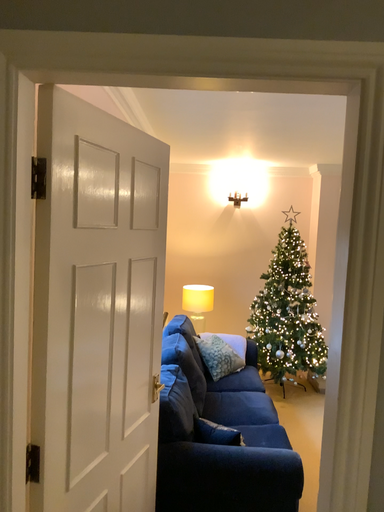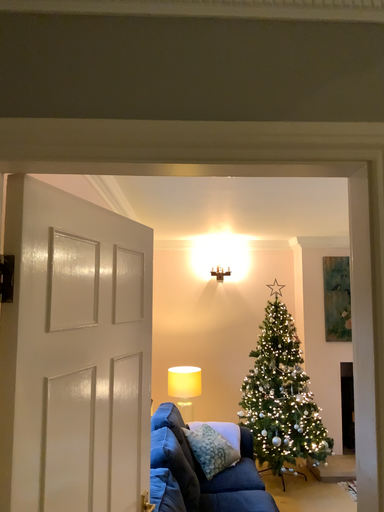
Question: Which way did the camera rotate in the video?

Choices:
 (A) rotated upward
 (B) rotated downward

Answer: (A)